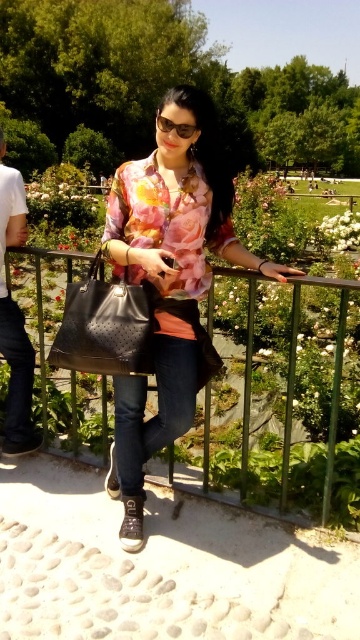
Is point (124, 500) more distant than point (246, 422)?

Yes.

Is floral-patterned shirt at center above green metal fence at center?

Correct, floral-patterned shirt at center is located above green metal fence at center.

I want to click on floral-patterned shirt at center, so click(x=169, y=282).

Which of these two, floral-patterned shirt at center or white cotton shirt at left, stands taller?

With more height is floral-patterned shirt at center.

Is floral-patterned shirt at center below white cotton shirt at left?

Indeed, floral-patterned shirt at center is positioned under white cotton shirt at left.

Does point (218, 170) come in front of point (14, 172)?

Yes, point (218, 170) is in front of point (14, 172).

Locate an element on the screen. floral-patterned shirt at center is located at coordinates (169, 282).

Is green metal fence at center in front of white cotton shirt at left?

Yes, it is.

From the picture: Who is more distant from viewer, (208, 323) or (24, 234)?

The point (24, 234) is more distant.

Locate an element on the screen. green metal fence at center is located at coordinates (331, 388).